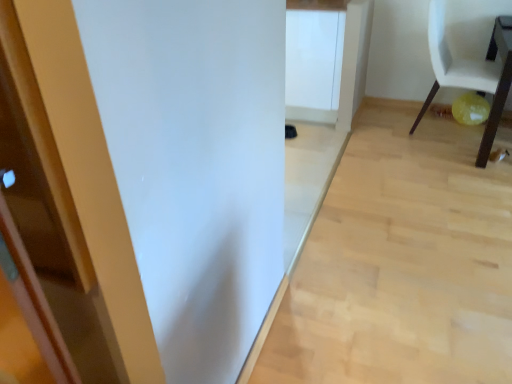
This screenshot has width=512, height=384. What are the coordinates of `vacant position to the left of white matte chair at right` in the screenshot? It's located at (390, 134).